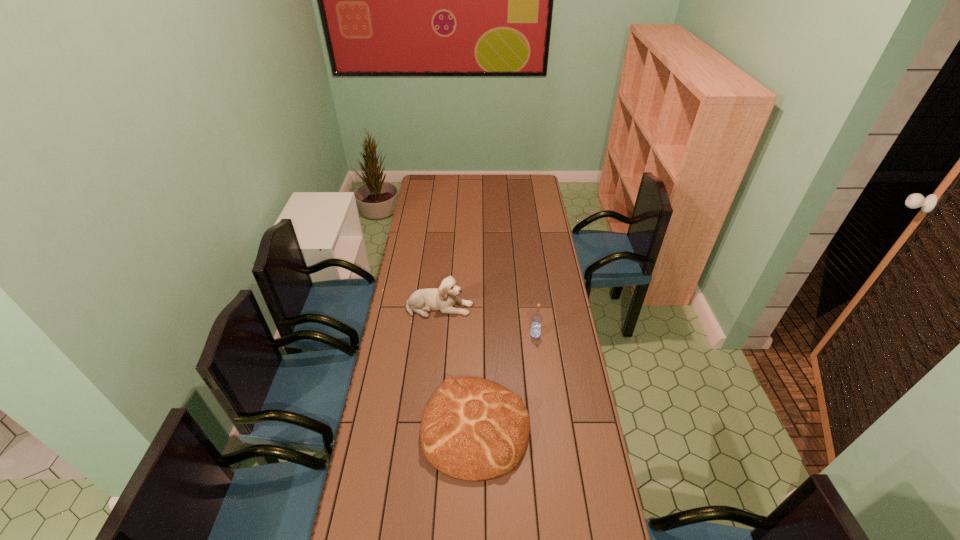
Locate an element on the screen. vacant space at the right edge of the desktop is located at coordinates (532, 314).

You are a GUI agent. You are given a task and a screenshot of the screen. Output one action in this format:
    pyautogui.click(x=<x>, y=<y>)
    Task: Click on the vacant space at the far left corner
    This screenshot has width=960, height=540.
    Given the screenshot: What is the action you would take?
    pyautogui.click(x=420, y=176)

You are a GUI agent. You are given a task and a screenshot of the screen. Output one action in this format:
    pyautogui.click(x=<x>, y=<y>)
    Task: Click on the vacant space in between the puppy and the rightmost object
    The width and height of the screenshot is (960, 540).
    Given the screenshot: What is the action you would take?
    pyautogui.click(x=488, y=321)

I want to click on free space between the second farthest object and the nearest object, so click(x=505, y=381).

At what (x,y) coordinates should I click in order to perform the action: click on empty space that is in between the vodka and the puppy. Please return your answer as a coordinate pair (x, y). Image resolution: width=960 pixels, height=540 pixels. Looking at the image, I should click on (488, 321).

What are the coordinates of `vacant space that is in between the puppy and the nearest object` in the screenshot? It's located at (458, 367).

I want to click on the closest object to the puppy, so click(x=535, y=331).

Identify which object is the second closest to the farthest object. Please provide its 2D coordinates. Your answer should be formatted as a tuple, i.e. [(x, y)], where the tuple contains the x and y coordinates of a point satisfying the conditions above.

[(473, 429)]

This screenshot has width=960, height=540. Identify the location of vacant region that satisfies the following two spatial constraints: 1. on the back side of the nearest object; 2. on the right side of the vodka. (476, 334).

At what (x,y) coordinates should I click in order to perform the action: click on free location that satisfies the following two spatial constraints: 1. on the front-facing side of the puppy; 2. on the back side of the bread. Please return your answer as a coordinate pair (x, y). The width and height of the screenshot is (960, 540). Looking at the image, I should click on (428, 427).